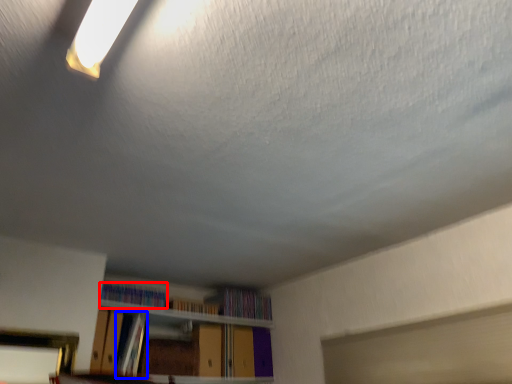
Question: Among these objects, which one is farthest to the camera, book (highlighted by a red box) or book (highlighted by a blue box)?

Choices:
 (A) book
 (B) book

Answer: (A)